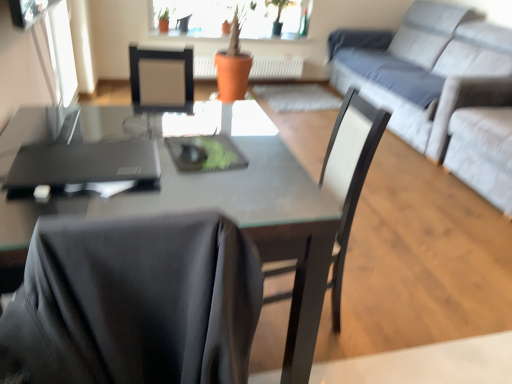
Question: Considering the relative sizes of black matte laptop at left and transparent glass window screen at upper left in the image provided, is black matte laptop at left bigger than transparent glass window screen at upper left?

Choices:
 (A) yes
 (B) no

Answer: (B)

Question: Are black matte laptop at left and transparent glass window screen at upper left located far from each other?

Choices:
 (A) no
 (B) yes

Answer: (B)

Question: Is black matte laptop at left to the left of transparent glass window screen at upper left from the viewer's perspective?

Choices:
 (A) no
 (B) yes

Answer: (A)

Question: Does black matte laptop at left lie in front of transparent glass window screen at upper left?

Choices:
 (A) no
 (B) yes

Answer: (B)

Question: Considering the relative positions of black matte laptop at left and transparent glass window screen at upper left in the image provided, is black matte laptop at left to the right of transparent glass window screen at upper left from the viewer's perspective?

Choices:
 (A) no
 (B) yes

Answer: (B)

Question: Is orange matte pot at center to the left or to the right of matte black desk at center in the image?

Choices:
 (A) left
 (B) right

Answer: (B)

Question: From the image's perspective, is orange matte pot at center located above or below matte black desk at center?

Choices:
 (A) above
 (B) below

Answer: (A)

Question: In terms of height, does orange matte pot at center look taller or shorter compared to matte black desk at center?

Choices:
 (A) short
 (B) tall

Answer: (A)

Question: Is point (194, 61) closer or farther from the camera than point (261, 127)?

Choices:
 (A) closer
 (B) farther

Answer: (B)

Question: Is matte black desk at center inside the boundaries of light gray fabric couch at upper right, or outside?

Choices:
 (A) inside
 (B) outside

Answer: (B)

Question: Considering the positions of point (270, 142) and point (431, 139), is point (270, 142) closer or farther from the camera than point (431, 139)?

Choices:
 (A) farther
 (B) closer

Answer: (B)

Question: From a real-world perspective, is matte black desk at center physically located above or below light gray fabric couch at upper right?

Choices:
 (A) above
 (B) below

Answer: (B)

Question: Based on their sizes in the image, would you say matte black desk at center is bigger or smaller than light gray fabric couch at upper right?

Choices:
 (A) big
 (B) small

Answer: (B)

Question: From a real-world perspective, is orange matte pot at center positioned above or below black matte chair at center?

Choices:
 (A) above
 (B) below

Answer: (B)

Question: Considering the positions of orange matte pot at center and black matte chair at center in the image, is orange matte pot at center taller or shorter than black matte chair at center?

Choices:
 (A) tall
 (B) short

Answer: (B)